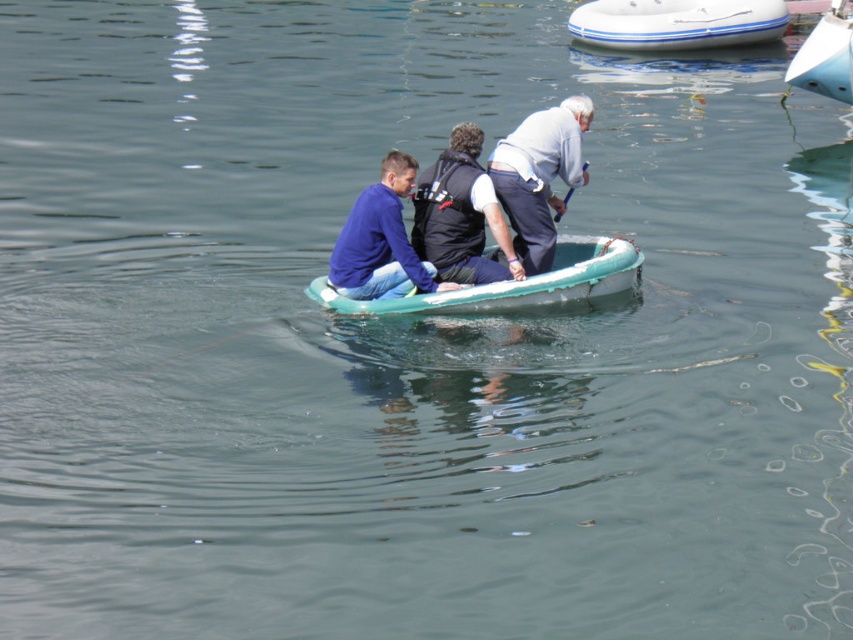
You are on a teal rubber boat at center and want to know if your boat is taller than the white rubber boat at upper center. Can you confirm?

The teal rubber boat at center is not as tall as the white rubber boat at upper center, so it is shorter than the white rubber boat at upper center.

You are on a boat and need to reach the black matte vest at center to retrieve a dropped item. The white rubber boat at upper center is blocking your path. Can you move around it to get to the vest?

The black matte vest at center is below the white rubber boat at upper center, so you can move around the white rubber boat at upper center to access the black matte vest at center.